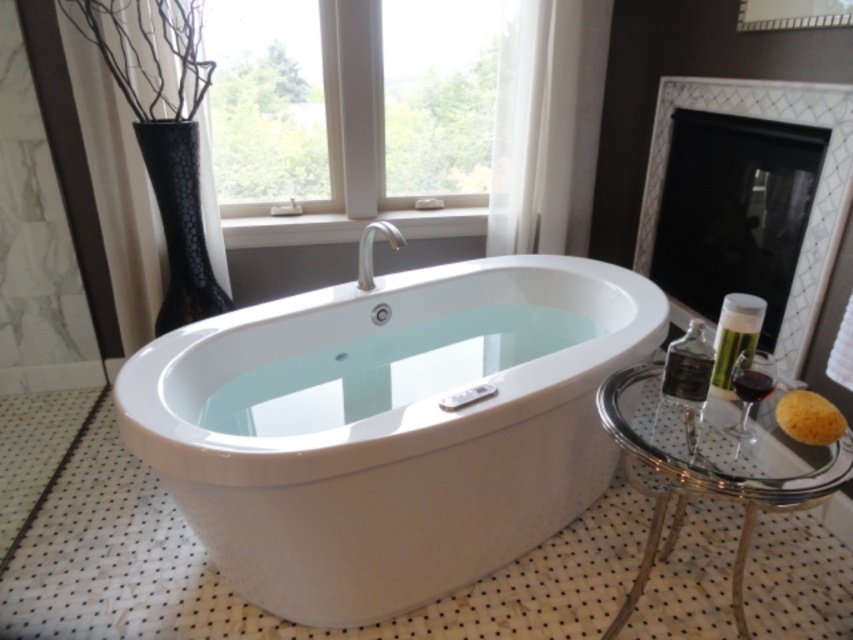
You are designing a layout for a new bathroom and want to place a large plant in the corner farthest from the transparent glass window at upper center and clear glass stool at lower right. Which corner should you choose?

The corner farthest from both the transparent glass window at upper center and the clear glass stool at lower right would be the lower left corner.

You are designing a layout for a bathroom and need to ensure that the transparent glass window at upper center and the clear glass stool at lower right are visible from the entrance. Since the entrance is at the front of the room, which object will be more visible first when entering?

The transparent glass window at upper center is taller than the clear glass stool at lower right, so it will be more visible first when entering the bathroom because its greater height allows it to be seen over the stool.

Based on the photo, you are standing in the bathroom and want to open the transparent glass window at upper center to let some fresh air in. Based on its position, can you estimate where you should walk to reach it?

The transparent glass window at upper center is located at point coordinates 0.189 on the x axis and 0.470 on the y axis, so you should walk towards the upper center area of the bathroom to reach it.